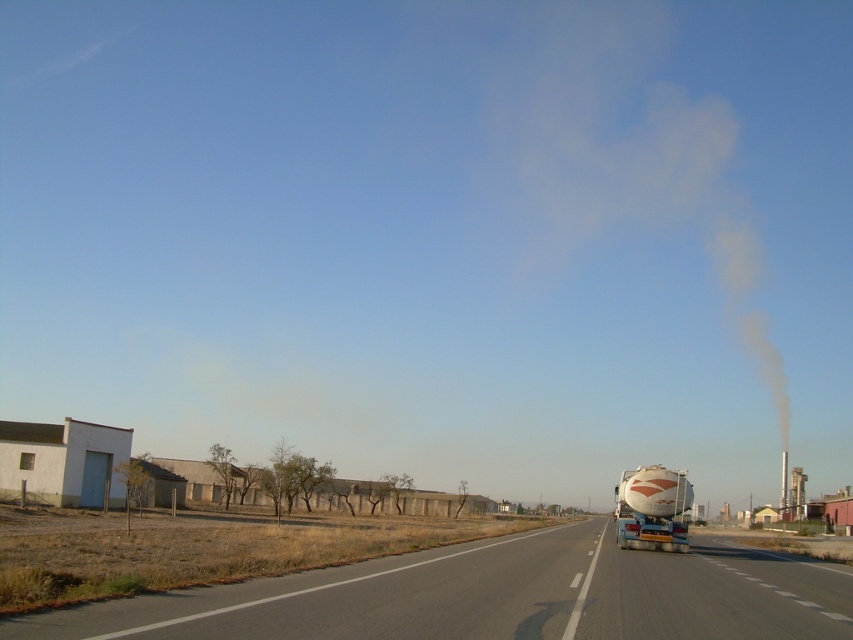
You are a driver approaching the gray asphalt highway at center and the white glossy tanker at right. Based on their positions, which object is closer to the horizon?

The gray asphalt highway at center is below the white glossy tanker at right, meaning the tanker is closer to the horizon than the highway.

You are a drone operator trying to capture aerial footage of the gray asphalt highway at center. Your drone is currently at the point marked by point (495, 596). Can you determine if the drone is positioned directly above the highway?

The point (495, 596) marks the gray asphalt highway at center, so yes, the drone is positioned directly above the highway.

You are standing at the edge of the gray asphalt highway at center and want to cross it to reach the other side. If your walking speed is 1.2 meters per second, how many seconds will it take you to cross the highway safely?

The gray asphalt highway at center and viewer are 8.02 meters apart from each other. To cross the highway safely, you would need to cover this distance. At a walking speed of 1.2 meters per second, it would take approximately 6.68 seconds to cross the highway safely.